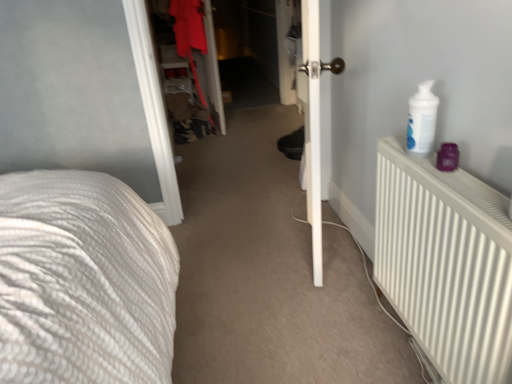
Question: Is white smooth door at center behind white matte radiator at right?

Choices:
 (A) no
 (B) yes

Answer: (B)

Question: Is white smooth door at center oriented away from white matte radiator at right?

Choices:
 (A) yes
 (B) no

Answer: (B)

Question: Is white smooth door at center to the left of white matte radiator at right from the viewer's perspective?

Choices:
 (A) no
 (B) yes

Answer: (B)

Question: Does white smooth door at center have a greater height compared to white matte radiator at right?

Choices:
 (A) no
 (B) yes

Answer: (B)

Question: Is white smooth door at center completely or partially outside of white matte radiator at right?

Choices:
 (A) no
 (B) yes

Answer: (B)

Question: From a real-world perspective, is white smooth door at center physically above white matte radiator at right?

Choices:
 (A) yes
 (B) no

Answer: (A)

Question: Is white matte radiator at right to the left of white smooth door at center from the viewer's perspective?

Choices:
 (A) yes
 (B) no

Answer: (B)

Question: Does white matte radiator at right have a larger size compared to white smooth door at center?

Choices:
 (A) no
 (B) yes

Answer: (A)

Question: Is white matte radiator at right further to camera compared to white smooth door at center?

Choices:
 (A) yes
 (B) no

Answer: (B)

Question: Does white matte radiator at right lie in front of white smooth door at center?

Choices:
 (A) yes
 (B) no

Answer: (A)

Question: Is white matte radiator at right facing away from white smooth door at center?

Choices:
 (A) no
 (B) yes

Answer: (A)

Question: From a real-world perspective, is white matte radiator at right on white smooth door at center?

Choices:
 (A) yes
 (B) no

Answer: (B)

Question: Can you confirm if white smooth door at center is thinner than matte red coat at center?

Choices:
 (A) no
 (B) yes

Answer: (B)